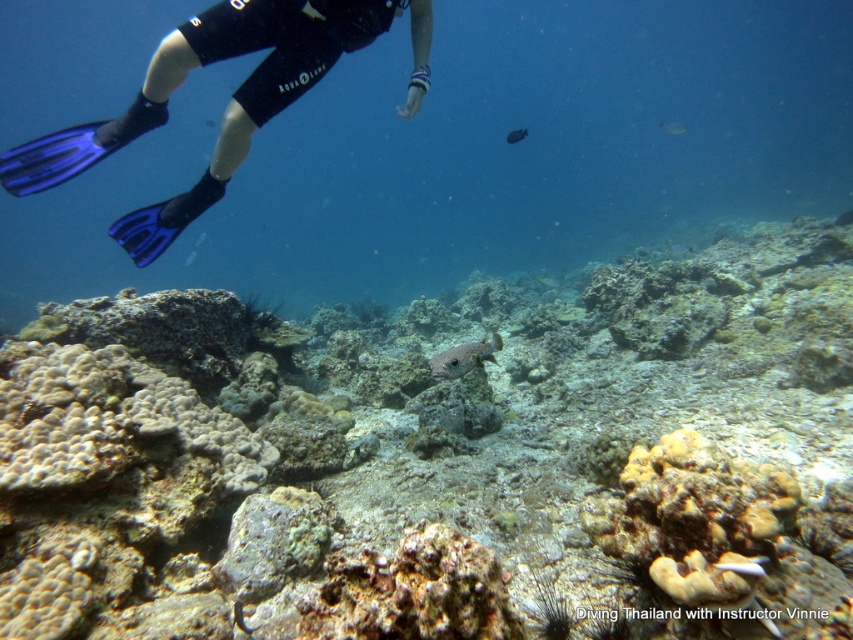
Locate an element on the screen. The width and height of the screenshot is (853, 640). white matte fish at center is located at coordinates (744, 566).

Which is behind, point (732, 563) or point (679, 131)?

The point (679, 131) is more distant.

Who is more distant from viewer, (764, 561) or (668, 124)?

The point (668, 124) is behind.

This screenshot has width=853, height=640. Identify the location of white matte fish at center. (744, 566).

Is rough textured coral reef at center taller than white matte fish at center?

Yes.

Does rough textured coral reef at center appear over white matte fish at center?

Correct, rough textured coral reef at center is located above white matte fish at center.

Find the location of a particular element. Image resolution: width=853 pixels, height=640 pixels. rough textured coral reef at center is located at coordinates (440, 460).

Does point (488, 356) come farther from viewer compared to point (737, 572)?

Yes, point (488, 356) is farther from viewer.

Where is `speckled gray fish at center`? speckled gray fish at center is located at coordinates (463, 356).

Who is more distant from viewer, (490, 349) or (735, 563)?

The point (490, 349) is more distant.

Where is `speckled gray fish at center`? This screenshot has width=853, height=640. speckled gray fish at center is located at coordinates (463, 356).